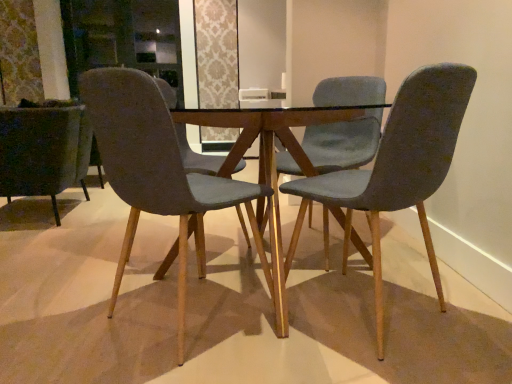
Locate an element on the screen. The image size is (512, 384). vacant region to the left of velvet grey chair at center, which is the third chair in right-to-left order is located at coordinates (71, 313).